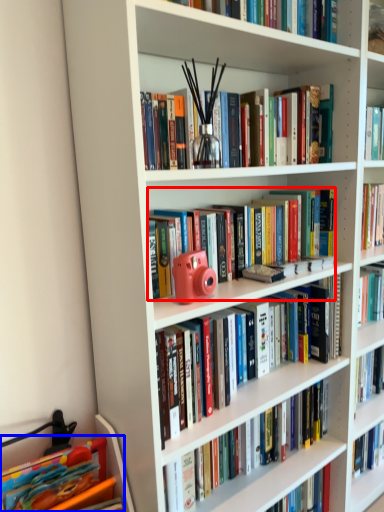
Question: Which object appears farthest to the camera in this image, book (highlighted by a red box) or book (highlighted by a blue box)?

Choices:
 (A) book
 (B) book

Answer: (A)